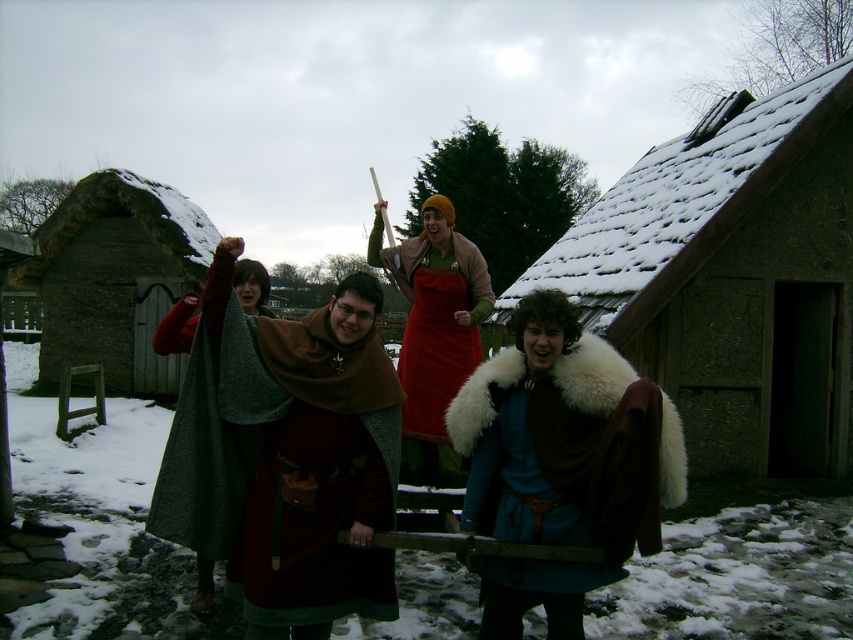
Can you confirm if rustic stone hut at center is thinner than brown fur-lined cloak at center?

Yes, rustic stone hut at center is thinner than brown fur-lined cloak at center.

Is point (786, 276) closer to viewer compared to point (614, 534)?

That is False.

Find the location of `rustic stone hut at center`. rustic stone hut at center is located at coordinates (732, 276).

Who is positioned more to the left, rustic stone hut at center or velvet red dress at center?

velvet red dress at center

Can you confirm if rustic stone hut at center is positioned to the right of velvet red dress at center?

Yes, rustic stone hut at center is to the right of velvet red dress at center.

Describe the element at coordinates (732, 276) in the screenshot. This screenshot has height=640, width=853. I see `rustic stone hut at center` at that location.

Image resolution: width=853 pixels, height=640 pixels. I want to click on rustic stone hut at center, so click(x=732, y=276).

You are a GUI agent. You are given a task and a screenshot of the screen. Output one action in this format:
    pyautogui.click(x=<x>, y=<y>)
    Task: Click on the dark brown wooden hut at left
    The height and width of the screenshot is (640, 853).
    Given the screenshot: What is the action you would take?
    pyautogui.click(x=115, y=276)

From the picture: Who is positioned more to the left, dark brown wooden hut at left or velvet red dress at center?

From the viewer's perspective, dark brown wooden hut at left appears more on the left side.

Does point (54, 296) come behind point (433, 212)?

Yes, point (54, 296) is farther from viewer.

This screenshot has width=853, height=640. I want to click on dark brown wooden hut at left, so click(x=115, y=276).